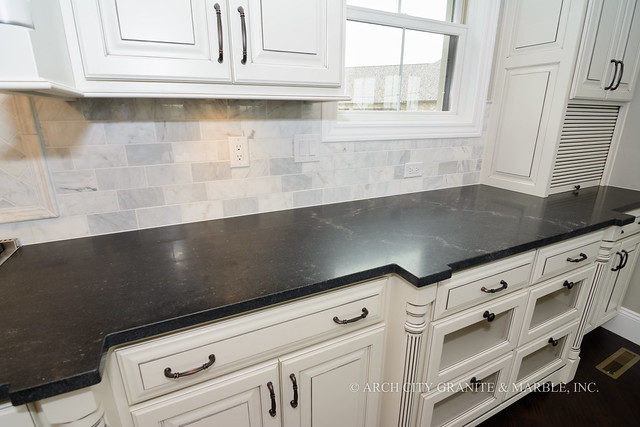
At what (x,y) coordinates should I click in order to perform the action: click on drawers. Please return your answer as a coordinate pair (x, y). Looking at the image, I should click on (291, 327), (470, 294), (572, 261).